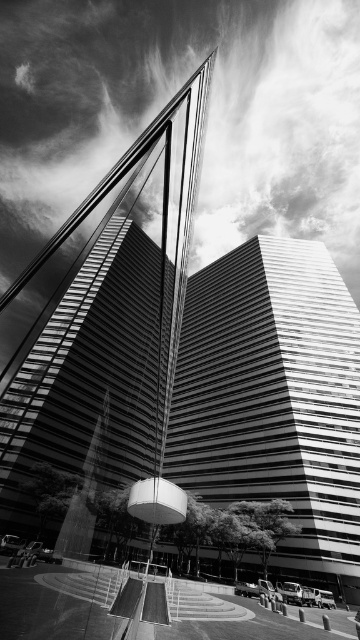
Question: Which point is closer to the camera?

Choices:
 (A) (245, 307)
 (B) (115, 273)

Answer: (A)

Question: Is smooth glass skyscraper at center to the right of smooth glass tower at center from the viewer's perspective?

Choices:
 (A) no
 (B) yes

Answer: (A)

Question: From the image, what is the correct spatial relationship of smooth glass skyscraper at center in relation to smooth glass tower at center?

Choices:
 (A) left
 (B) right

Answer: (A)

Question: Is smooth glass skyscraper at center thinner than smooth glass tower at center?

Choices:
 (A) yes
 (B) no

Answer: (B)

Question: Which of the following is the farthest from the observer?

Choices:
 (A) smooth glass skyscraper at center
 (B) smooth glass tower at center

Answer: (B)